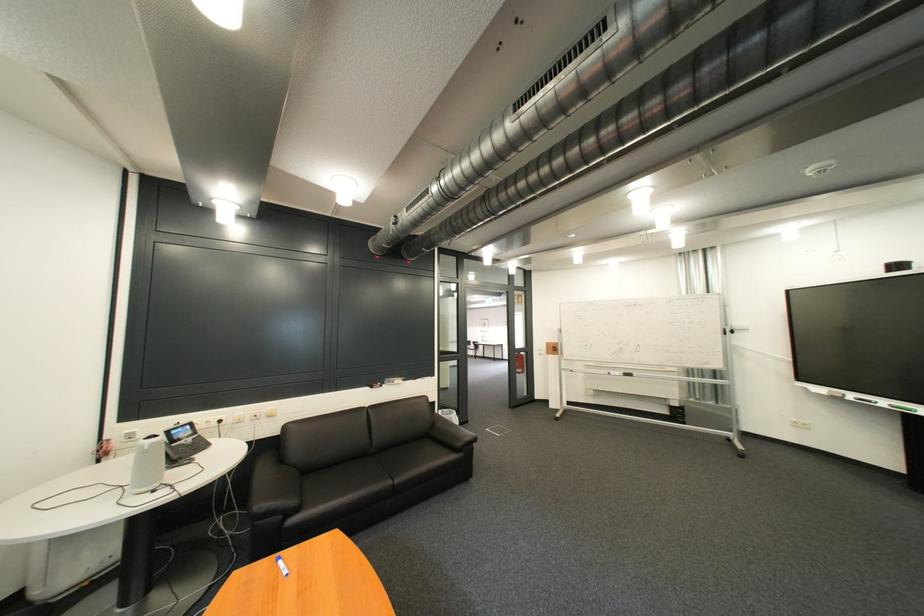
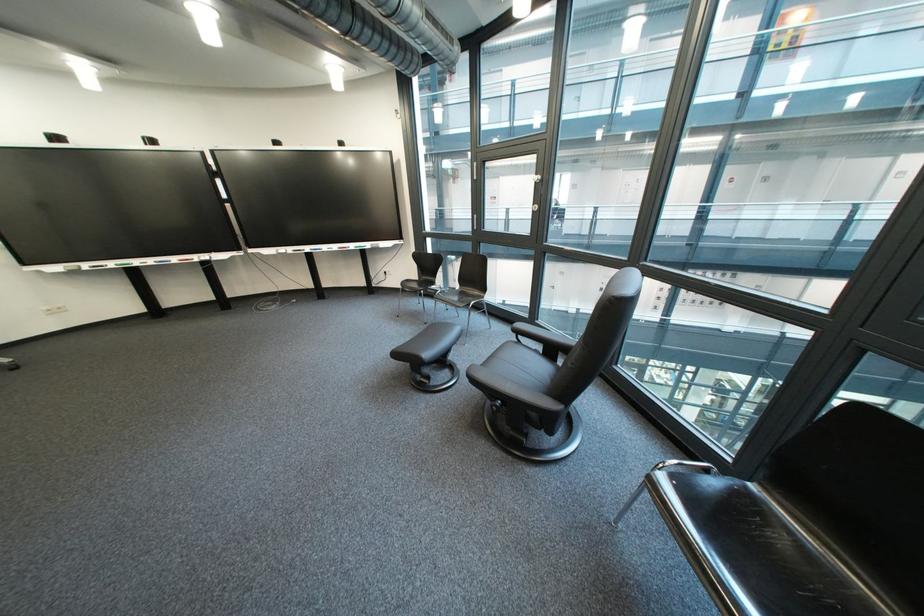
The images are taken continuously from a first-person perspective. In which direction is your viewpoint rotating?

The camera's rotation is toward right-down.